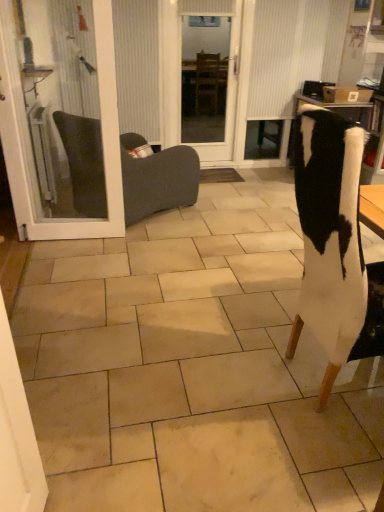
Question: From a real-world perspective, does white textured curtain at upper center sit lower than white glass door at left?

Choices:
 (A) no
 (B) yes

Answer: (A)

Question: Considering the relative positions of white textured curtain at upper center and white glass door at left in the image provided, is white textured curtain at upper center to the right of white glass door at left from the viewer's perspective?

Choices:
 (A) no
 (B) yes

Answer: (B)

Question: Does white textured curtain at upper center touch white glass door at left?

Choices:
 (A) yes
 (B) no

Answer: (B)

Question: Is white textured curtain at upper center not close to white glass door at left?

Choices:
 (A) no
 (B) yes

Answer: (B)

Question: Is white textured curtain at upper center positioned behind white glass door at left?

Choices:
 (A) yes
 (B) no

Answer: (A)

Question: From the image's perspective, is white textured curtain at upper center above white glass door at left?

Choices:
 (A) no
 (B) yes

Answer: (B)

Question: Does transparent glass door at center have a lesser width compared to dark gray fabric chair at left, which ranks as the 2th chair in right-to-left order?

Choices:
 (A) yes
 (B) no

Answer: (A)

Question: Considering the relative positions of transparent glass door at center and dark gray fabric chair at left, which is the second chair in front-to-back order, in the image provided, is transparent glass door at center to the left of dark gray fabric chair at left, which is the second chair in front-to-back order, from the viewer's perspective?

Choices:
 (A) yes
 (B) no

Answer: (B)

Question: Is transparent glass door at center next to dark gray fabric chair at left, which ranks as the 2th chair in right-to-left order?

Choices:
 (A) yes
 (B) no

Answer: (B)

Question: Could dark gray fabric chair at left, which is the second chair in front-to-back order, be considered to be inside transparent glass door at center?

Choices:
 (A) no
 (B) yes

Answer: (A)

Question: Does transparent glass door at center lie in front of dark gray fabric chair at left, which is the 1th chair in back-to-front order?

Choices:
 (A) yes
 (B) no

Answer: (B)

Question: Is transparent glass door at center oriented away from dark gray fabric chair at left, acting as the 1th chair starting from the left?

Choices:
 (A) no
 (B) yes

Answer: (A)

Question: Can you confirm if dark gray fabric chair at left, which is the second chair in front-to-back order, is positioned to the left of white glass door at left?

Choices:
 (A) yes
 (B) no

Answer: (B)